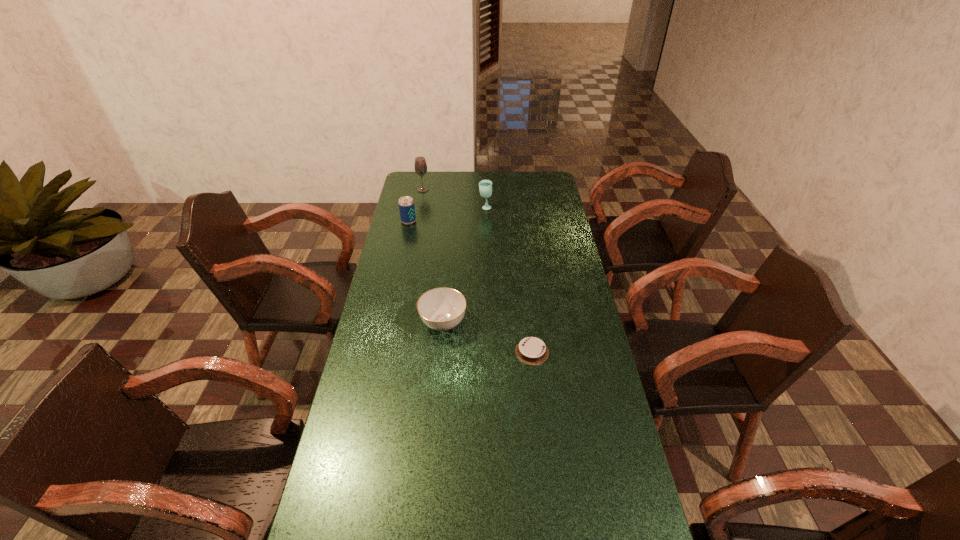
In order to click on the tallest object in this screenshot , I will do `click(420, 166)`.

The image size is (960, 540). In order to click on the left glass in this screenshot , I will do `click(420, 166)`.

The width and height of the screenshot is (960, 540). I want to click on the shorter glass, so coord(485,186).

In order to click on the fourth nearest object in this screenshot , I will do `click(485, 186)`.

Identify the location of the third farthest object. The image size is (960, 540). (406, 204).

Where is `chinaware`? Image resolution: width=960 pixels, height=540 pixels. chinaware is located at coordinates (441, 309).

Identify the location of the second shortest object. The image size is (960, 540). (441, 309).

Find the location of a particular element. The image size is (960, 540). the shortest object is located at coordinates (531, 350).

Identify the location of the rightmost object. (531, 350).

The width and height of the screenshot is (960, 540). Identify the location of vacant region located on the back of the farther glass. pos(426,175).